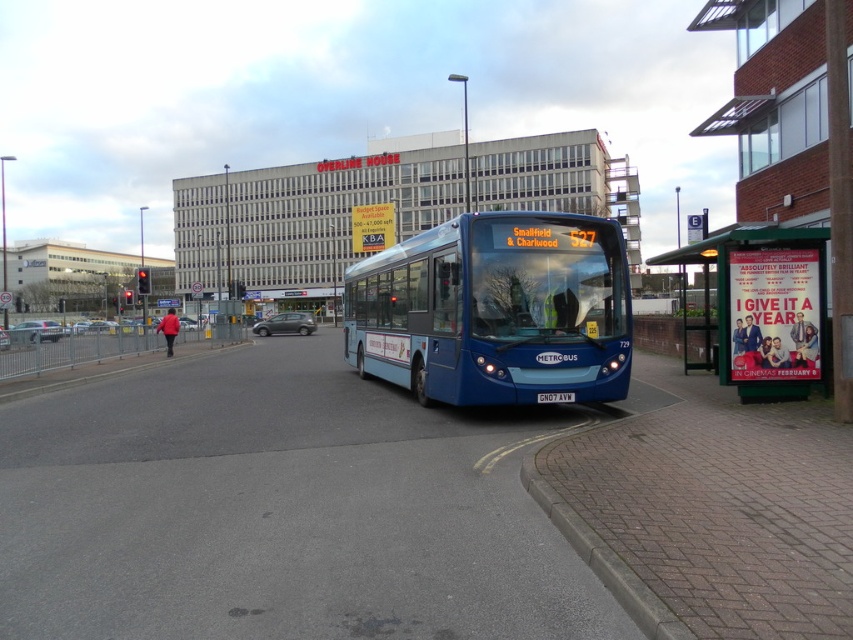
Can you confirm if brick pavement at lower right is bigger than metallic green bus stop at right?

Yes, brick pavement at lower right is bigger than metallic green bus stop at right.

How far apart are brick pavement at lower right and metallic green bus stop at right?

The distance of brick pavement at lower right from metallic green bus stop at right is 27.43 feet.

Image resolution: width=853 pixels, height=640 pixels. I want to click on brick pavement at lower right, so (281, 509).

Locate an element on the screen. Image resolution: width=853 pixels, height=640 pixels. brick pavement at lower right is located at coordinates click(x=281, y=509).

Is brick pavement at lower right above blue metallic bus at center?

No, brick pavement at lower right is not above blue metallic bus at center.

Which is more to the right, brick pavement at lower right or blue metallic bus at center?

blue metallic bus at center

Is point (289, 356) behind point (453, 339)?

That is True.

What are the coordinates of `brick pavement at lower right` in the screenshot? It's located at (281, 509).

Between blue metallic bus at center and metallic green bus stop at right, which one is positioned higher?

metallic green bus stop at right is above.

Does point (521, 252) come behind point (804, 394)?

No, (521, 252) is closer to viewer.

Is point (361, 266) less distant than point (703, 257)?

That is False.

The image size is (853, 640). I want to click on blue metallic bus at center, so click(x=495, y=310).